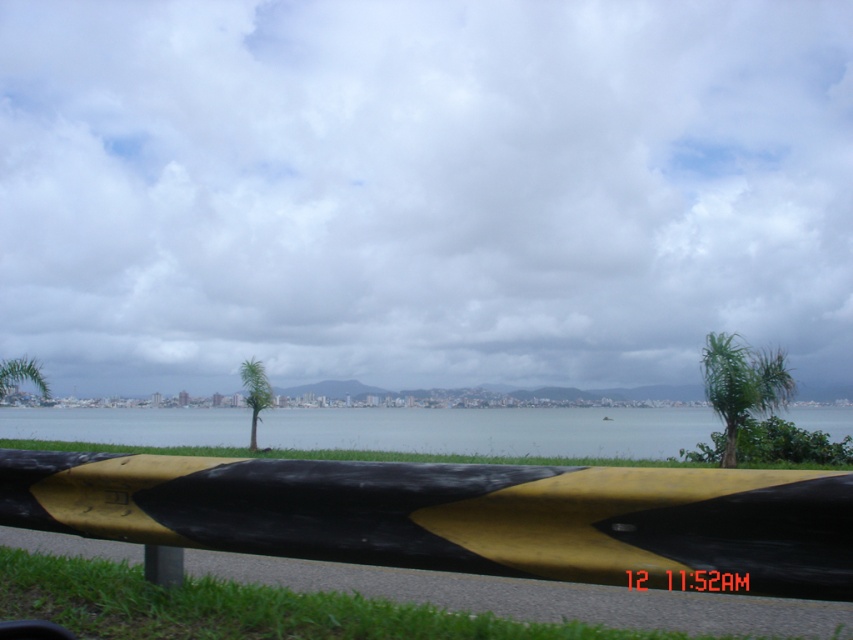
Is the position of yellow matte barrier at center less distant than that of blue water at center?

Yes.

Who is more forward, (344, 465) or (285, 410)?

Positioned in front is point (344, 465).

This screenshot has width=853, height=640. Identify the location of yellow matte barrier at center. (459, 515).

Does point (373, 490) come behind point (177, 566)?

No.

Is yellow matte barrier at center thinner than yellow matte pole at lower center?

No.

Is point (112, 534) positioned after point (177, 576)?

No, (112, 534) is closer to viewer.

Locate an element on the screen. yellow matte barrier at center is located at coordinates (459, 515).

Who is more forward, (x=47, y=436) or (x=161, y=572)?

Positioned in front is point (x=161, y=572).

Does blue water at center have a larger size compared to yellow matte pole at lower center?

Indeed, blue water at center has a larger size compared to yellow matte pole at lower center.

Is point (93, 433) positioned before point (180, 573)?

No, it is not.

The image size is (853, 640). I want to click on blue water at center, so click(492, 429).